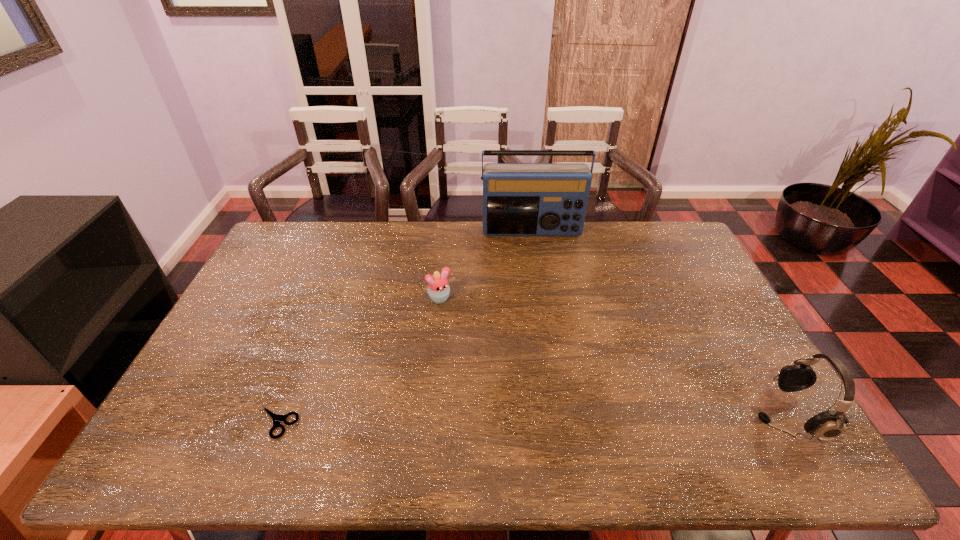
Where is `free space on the desktop that is between the shortest object and the second tallest object and is positioned on the face of the cupcake`? This screenshot has height=540, width=960. free space on the desktop that is between the shortest object and the second tallest object and is positioned on the face of the cupcake is located at coordinates (529, 418).

Where is `vacant spot on the desktop that is between the leftmost object and the rightmost object and is positioned on the front panel of the farthest object`? vacant spot on the desktop that is between the leftmost object and the rightmost object and is positioned on the front panel of the farthest object is located at coordinates (559, 417).